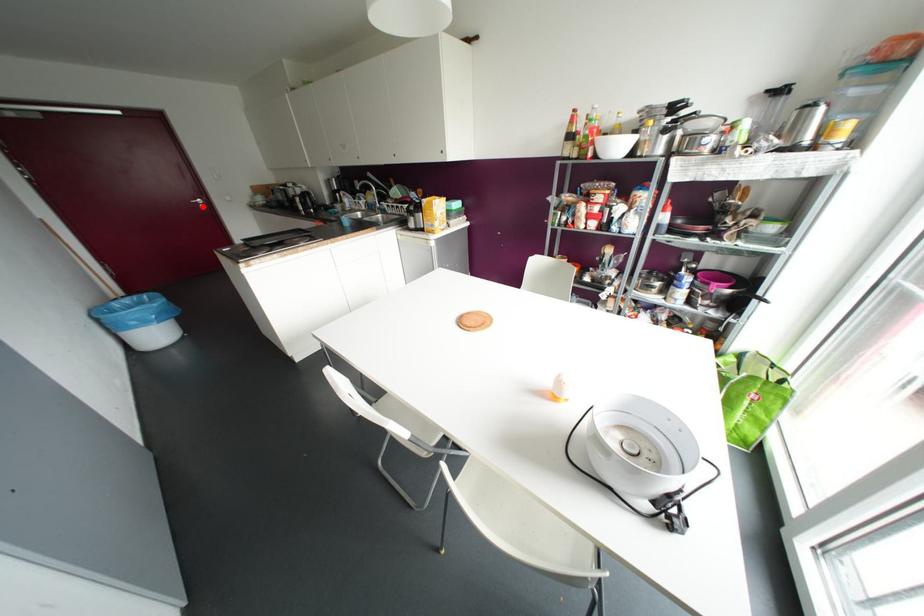
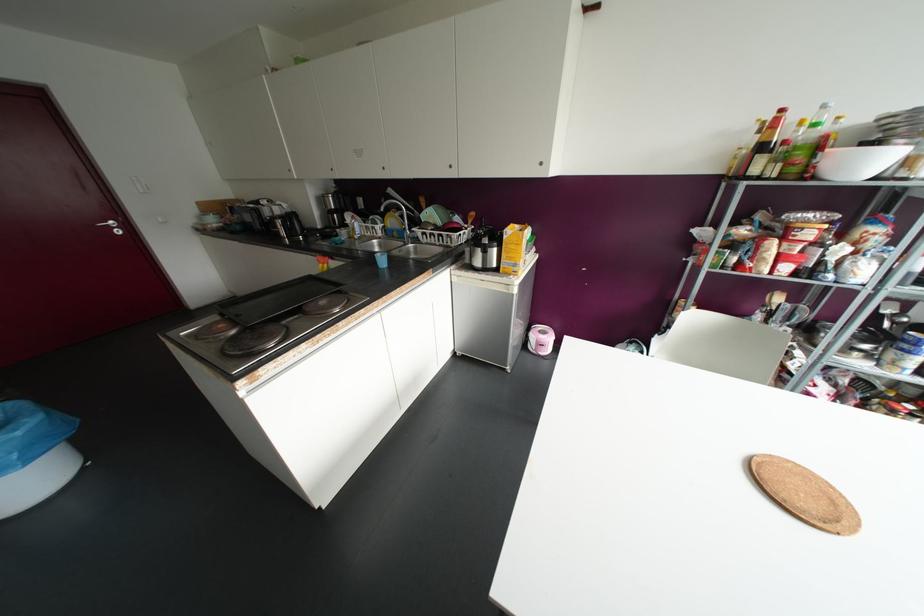
Question: I am providing you with two images of the same scene from different viewpoints. In image1, a red point is highlighted. Considering the same 3D point in image2, which of the following is correct?

Choices:
 (A) It is closer
 (B) It is farther

Answer: (B)